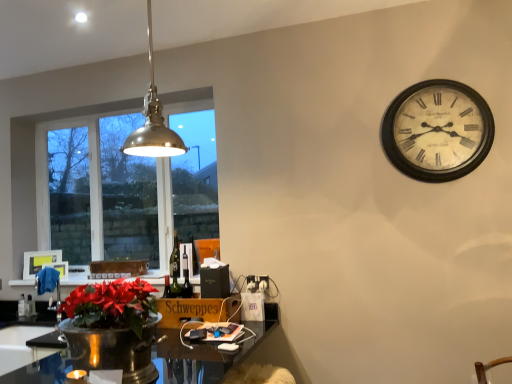
Question: In terms of width, does white plastic power outlet at lower center look wider or thinner when compared to wooden schweppes at lower center, placed as the first cardboard box when sorted from right to left?

Choices:
 (A) thin
 (B) wide

Answer: (A)

Question: From a real-world perspective, is white plastic power outlet at lower center above or below wooden schweppes at lower center, arranged as the 2th cardboard box when viewed from the back?

Choices:
 (A) above
 (B) below

Answer: (A)

Question: Estimate the real-world distances between objects in this image. Which object is closer to the shiny black desk at lower center?

Choices:
 (A) clear glass window at left
 (B) matte white picture frame at left, placed as the 1th picture frame when sorted from left to right
 (C) brown cardboard box at lower center, the first cardboard box viewed from the left
 (D) matte white picture frame at upper left, placed as the 2th picture frame when sorted from left to right
 (E) wooden schweppes at lower center, which ranks as the second cardboard box in left-to-right order

Answer: (E)

Question: Which object is positioned closest to the shiny black desk at lower center?

Choices:
 (A) matte white picture frame at left, the second picture frame in the right-to-left sequence
 (B) wooden schweppes at lower center, arranged as the 2th cardboard box when viewed from the back
 (C) white plastic power outlet at lower center
 (D) brown cardboard box at lower center, the 1th cardboard box viewed from the top
 (E) metallic pendant light at upper left

Answer: (B)